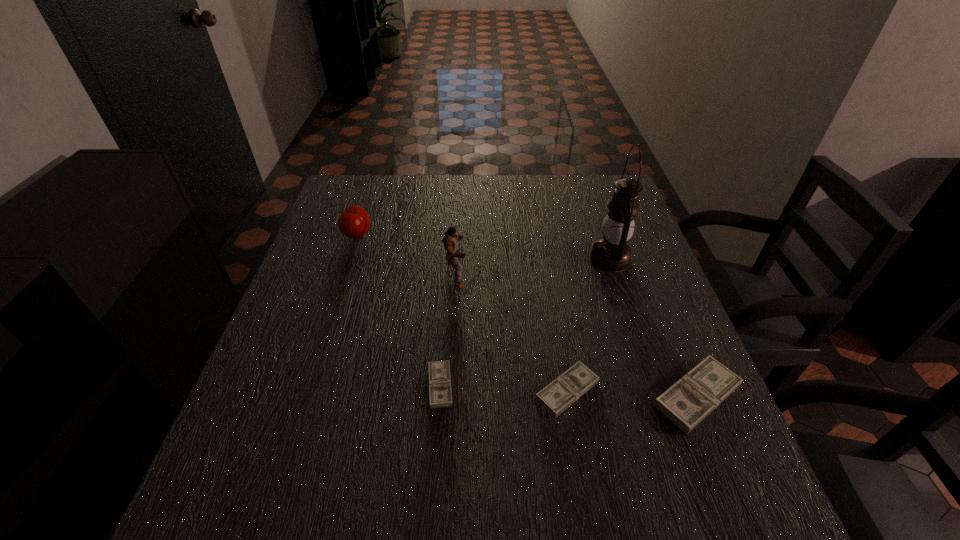
The moneys are evenly distributed in the image. To maintain this, where would you place another money on the left? Please point to a free space. Please provide its 2D coordinates. Your answer should be formatted as a tuple, i.e. [(x, y)], where the tuple contains the x and y coordinates of a point satisfying the conditions above.

[(316, 380)]